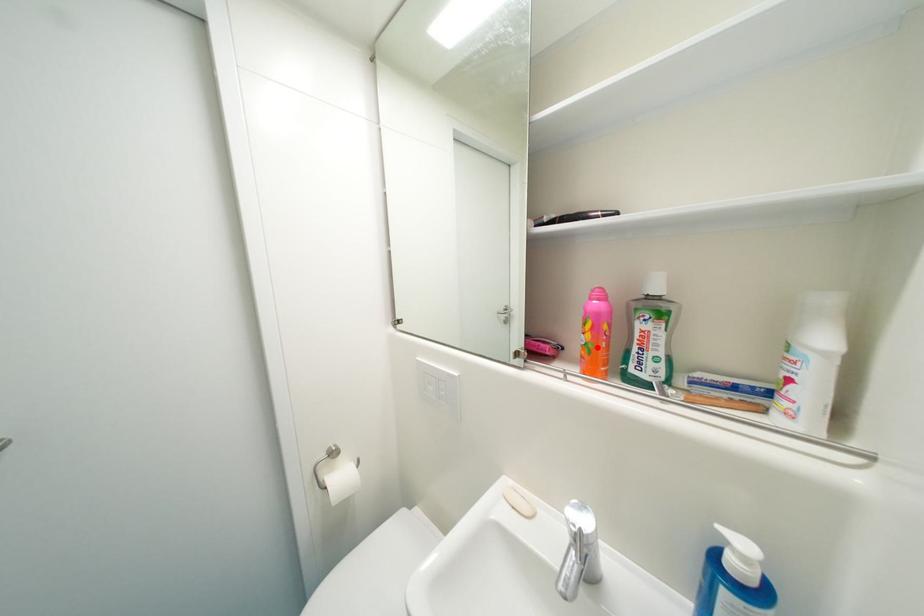
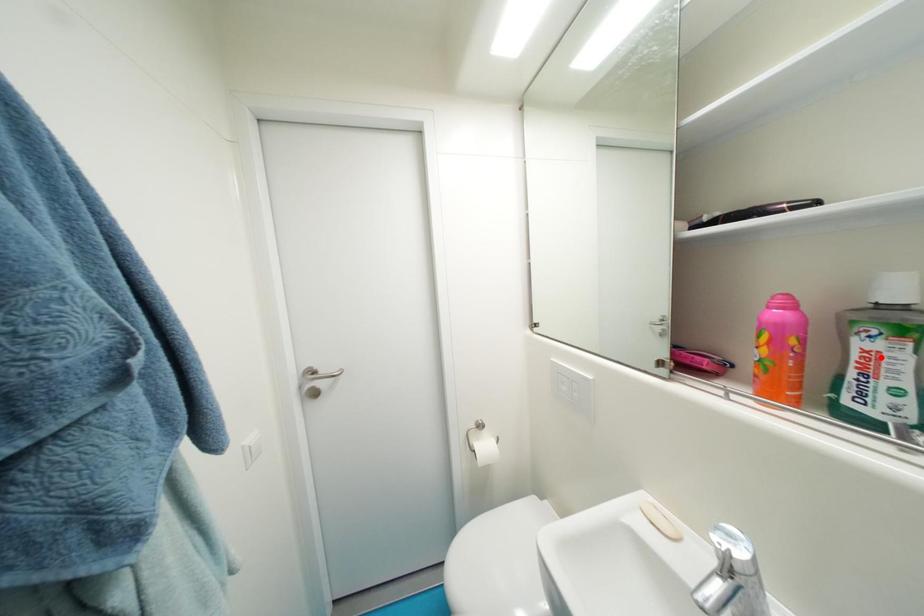
I am providing you with two images of the same scene from different viewpoints. A red point is marked on the first image and another point is marked on the second image. Are the points marked in image1 and image2 representing the same 3D position?

No